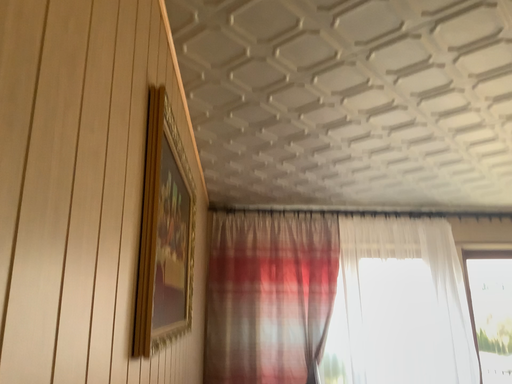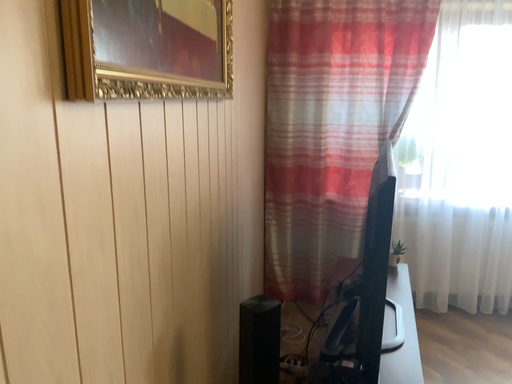
Question: Which way did the camera rotate in the video?

Choices:
 (A) rotated right
 (B) rotated left

Answer: (B)